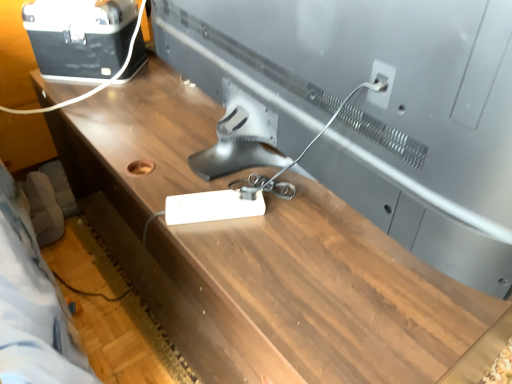
Find the location of a particular element. The width and height of the screenshot is (512, 384). vacant region to the right of matte black speaker at upper left is located at coordinates (164, 79).